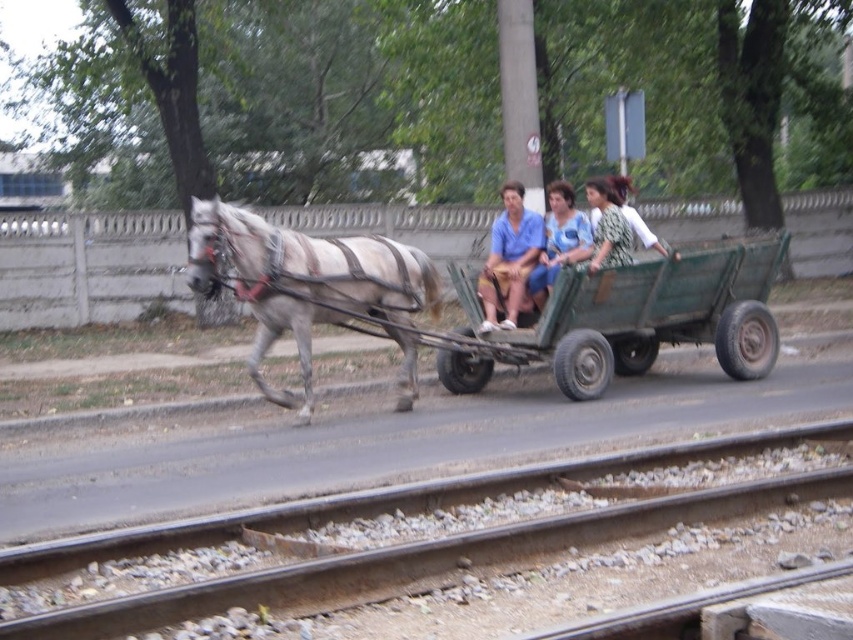
Question: Which object appears closest to the camera in this image?

Choices:
 (A) gray matte horse at left
 (B) green wooden wagon at center

Answer: (A)

Question: Can you confirm if rusty metal train track at lower center is positioned to the right of blue cotton shirt at center?

Choices:
 (A) yes
 (B) no

Answer: (B)

Question: Which object is positioned closest to the gray matte horse at left?

Choices:
 (A) matte blue shirt at center
 (B) blue cotton shirt at center

Answer: (A)

Question: Among these objects, which one is farthest from the camera?

Choices:
 (A) green textured dress at center
 (B) blue cotton shirt at center

Answer: (A)

Question: Is gray matte horse at left further to the viewer compared to blue cotton shirt at center?

Choices:
 (A) yes
 (B) no

Answer: (B)

Question: Is rusty metal train track at lower center behind green textured dress at center?

Choices:
 (A) no
 (B) yes

Answer: (A)